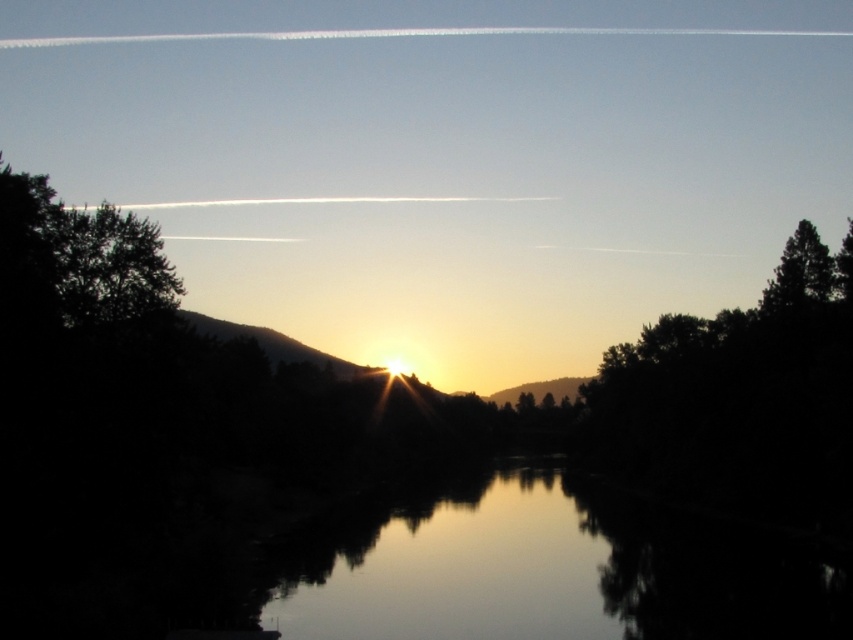
Who is positioned more to the right, dark green leafy tree at left or dark green textured tree at right?

Positioned to the right is dark green textured tree at right.

Who is positioned more to the left, dark green leafy tree at left or dark green textured tree at right?

Positioned to the left is dark green leafy tree at left.

I want to click on dark green leafy tree at left, so click(74, 260).

Locate an element on the screen. This screenshot has height=640, width=853. dark green leafy tree at left is located at coordinates (74, 260).